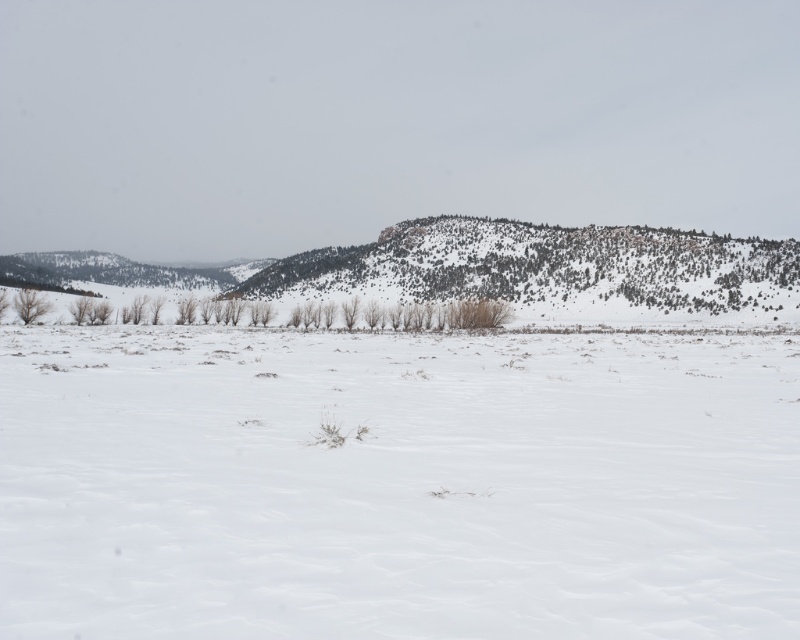
You are planning to build a snowman using the white fluffy snow at center and climb the green textured hill at center. Which object would you need to use first based on their heights?

The white fluffy snow at center is not as tall as the green textured hill at center, so you would need to use the white fluffy snow at center first to build the snowman before attempting to climb the hill.

You are standing in the winter landscape and want to take a photo of the white fluffy snow at center and the green textured hill at center. Which object should you focus on first if you want both to be in sharp focus?

You should focus on the green textured hill at center first because it is farther away than the white fluffy snow at center, ensuring both are in focus when using depth of field techniques.

You are planning to build a snowman using the white fluffy snow at center and the green textured hill at center. Which object provides a larger base for the snowman?

The green textured hill at center has a greater width than the white fluffy snow at center, so it can provide a larger base for the snowman.